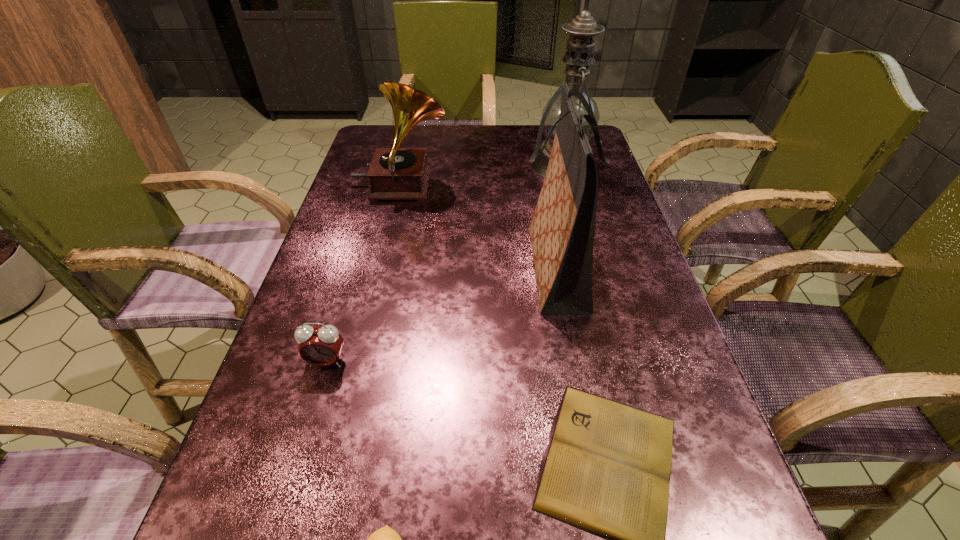
You are a GUI agent. You are given a task and a screenshot of the screen. Output one action in this format:
    pyautogui.click(x=<x>, y=<y>)
    Task: Click on the blank space at the far right corner
    This screenshot has width=960, height=540.
    Given the screenshot: What is the action you would take?
    pyautogui.click(x=597, y=153)

Find the location of a particular element. Image resolution: width=960 pixels, height=540 pixels. free area in between the phonograph record and the oil lamp is located at coordinates (482, 176).

Find the location of a particular element. The height and width of the screenshot is (540, 960). vacant space that is in between the fourth shortest object and the third farthest object is located at coordinates (477, 226).

Where is `the closest object to the alarm clock`? the closest object to the alarm clock is located at coordinates (385, 539).

Locate an element on the screen. Image resolution: width=960 pixels, height=540 pixels. object identified as the third closest to the phonograph record is located at coordinates (321, 346).